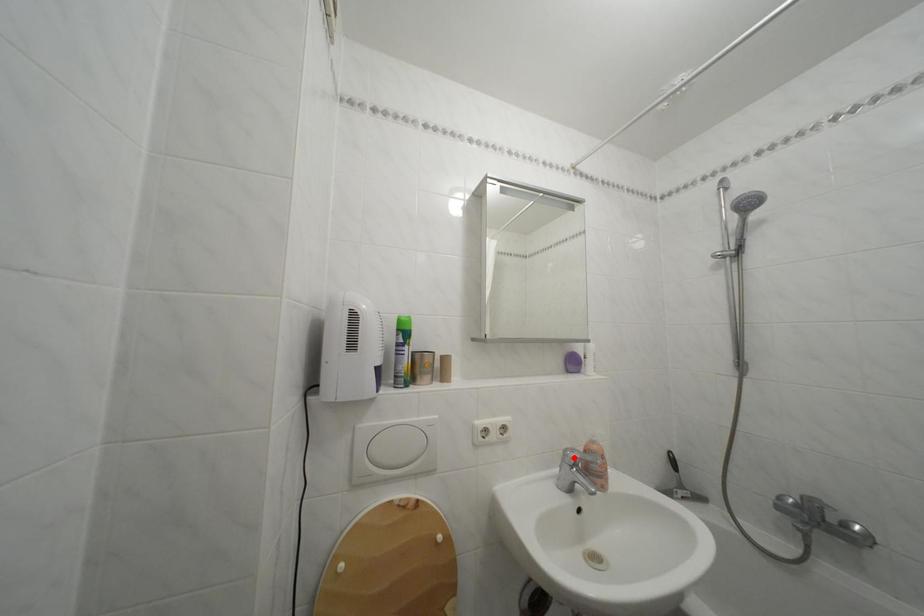
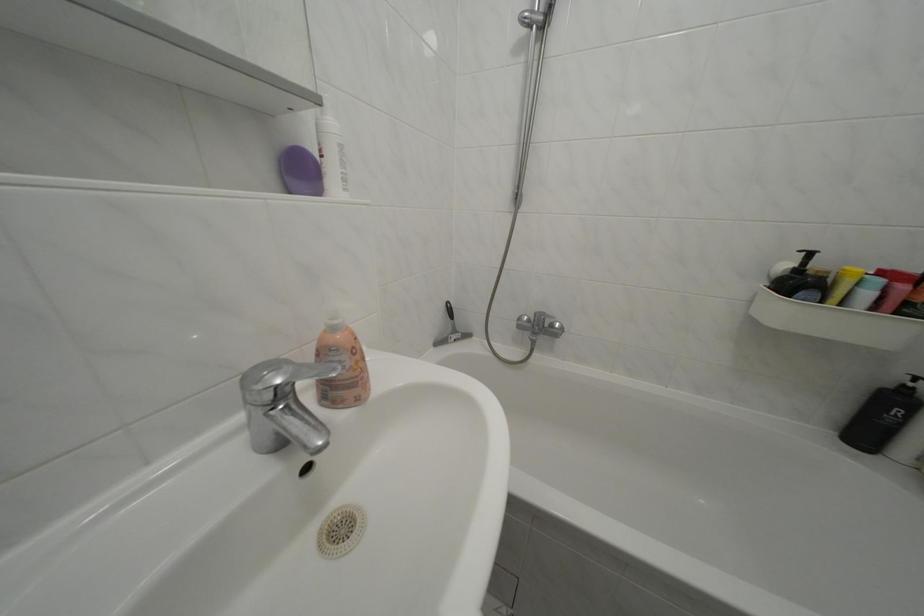
The point at the highlighted location is marked in the first image. Where is the corresponding point in the second image?

(252, 384)